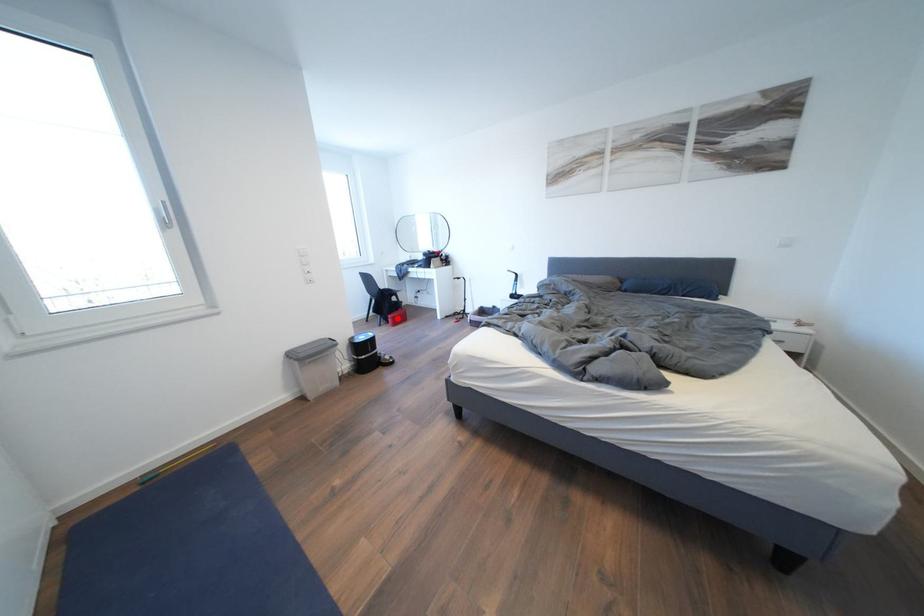
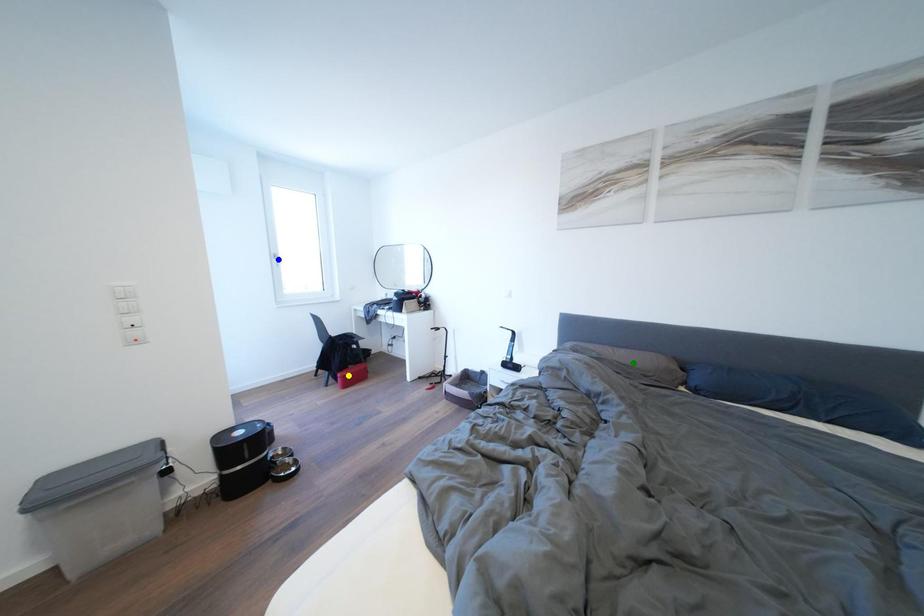
Question: I am providing you with two images of the same scene from different viewpoints. A red point is marked on the first image. You are given multiple points on the second image. Which spot in image 2 lines up with the point in image 1?

Choices:
 (A) blue point
 (B) yellow point
 (C) green point

Answer: (B)